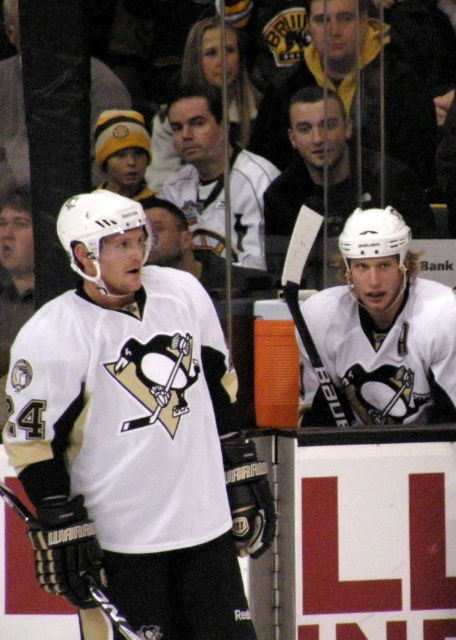
Question: Which point is farther to the camera?

Choices:
 (A) (328, 385)
 (B) (119, 170)
 (C) (416, 394)

Answer: (B)

Question: Does matte black helmet at upper left lie in front of black matte hockey stick at upper center?

Choices:
 (A) yes
 (B) no

Answer: (B)

Question: Does white matte jersey at left appear under black matte hockey stick at upper center?

Choices:
 (A) no
 (B) yes

Answer: (B)

Question: Does white matte jersey at left come behind white matte helmet at upper center?

Choices:
 (A) no
 (B) yes

Answer: (A)

Question: Which point is farther to the camera?

Choices:
 (A) (118, 168)
 (B) (397, 332)
 (C) (166, 627)
 (D) (336, 420)

Answer: (A)

Question: Which of the following is the farthest from the observer?

Choices:
 (A) (385, 243)
 (B) (98, 147)

Answer: (B)